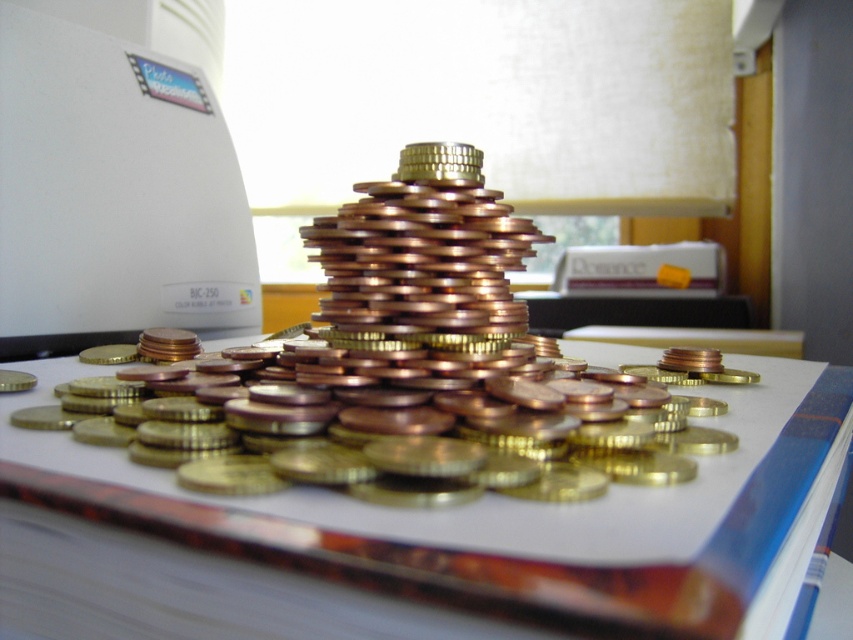
Question: Which object is farther from the camera taking this photo?

Choices:
 (A) metallic gold coins at center
 (B) gold shiny coins at center

Answer: (B)

Question: Among these objects, which one is nearest to the camera?

Choices:
 (A) metallic gold coins at center
 (B) gold shiny coins at center

Answer: (A)

Question: Is metallic gold coins at center wider than gold shiny coins at center?

Choices:
 (A) no
 (B) yes

Answer: (B)

Question: Can you confirm if metallic gold coins at center is wider than gold shiny coins at center?

Choices:
 (A) no
 (B) yes

Answer: (B)

Question: Is metallic gold coins at center thinner than gold shiny coins at center?

Choices:
 (A) no
 (B) yes

Answer: (A)

Question: Which of the following is the closest to the observer?

Choices:
 (A) (610, 616)
 (B) (184, 458)

Answer: (A)